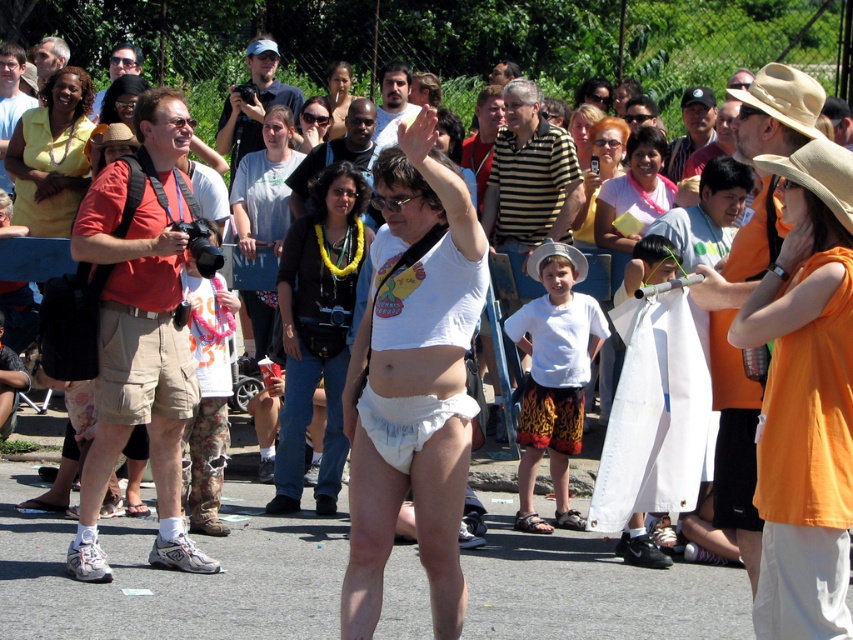
Between orange cotton shirt at upper right and yellow matte shirt at upper left, which one appears on the left side from the viewer's perspective?

yellow matte shirt at upper left is more to the left.

Between point (776, 372) and point (57, 141), which one is positioned in front?

Point (776, 372) is in front.

Is point (808, 516) closer to viewer compared to point (85, 88)?

That is True.

The width and height of the screenshot is (853, 640). In order to click on orange cotton shirt at upper right in this screenshot , I will do (x=805, y=400).

Is yellow matte shirt at upper left thinner than tan fabric cowboy hat at upper right?

Incorrect, yellow matte shirt at upper left's width is not less than tan fabric cowboy hat at upper right's.

Which is behind, point (32, 124) or point (808, 156)?

Positioned behind is point (32, 124).

This screenshot has height=640, width=853. What are the coordinates of `yellow matte shirt at upper left` in the screenshot? It's located at [51, 156].

Identify the location of orange cotton shirt at upper right. This screenshot has width=853, height=640. (805, 400).

Describe the element at coordinates (805, 400) in the screenshot. The height and width of the screenshot is (640, 853). I see `orange cotton shirt at upper right` at that location.

What are the coordinates of `orange cotton shirt at upper right` in the screenshot? It's located at (805, 400).